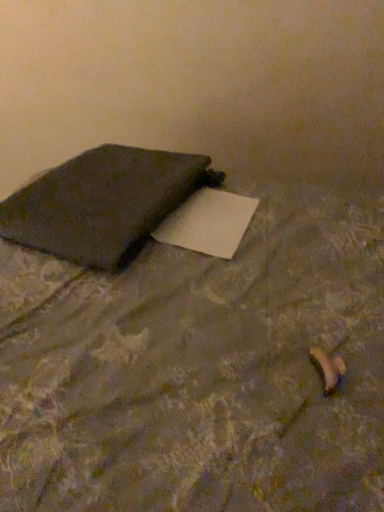
Question: Considering their positions, is matte black notebook at left located in front of or behind matte black pillow at upper left?

Choices:
 (A) behind
 (B) front

Answer: (A)

Question: From a real-world perspective, is matte black notebook at left above or below matte black pillow at upper left?

Choices:
 (A) above
 (B) below

Answer: (A)

Question: In the image, is matte black notebook at left on the left side or the right side of matte black pillow at upper left?

Choices:
 (A) right
 (B) left

Answer: (B)

Question: Is matte black pillow at upper left bigger or smaller than matte black notebook at left?

Choices:
 (A) big
 (B) small

Answer: (A)

Question: From their relative heights in the image, would you say matte black pillow at upper left is taller or shorter than matte black notebook at left?

Choices:
 (A) tall
 (B) short

Answer: (A)

Question: Relative to matte black notebook at left, is matte black pillow at upper left in front or behind?

Choices:
 (A) front
 (B) behind

Answer: (A)

Question: From a real-world perspective, is matte black pillow at upper left physically located above or below matte black notebook at left?

Choices:
 (A) below
 (B) above

Answer: (A)